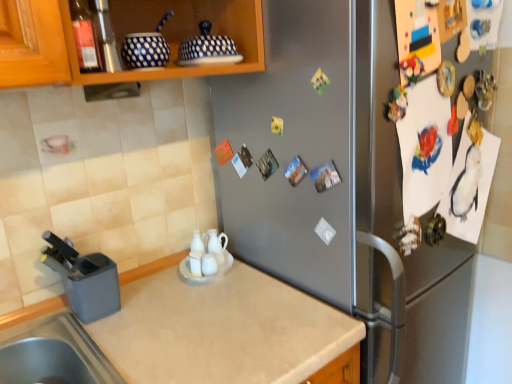
Locate an element on the screen. The width and height of the screenshot is (512, 384). empty space that is to the right of white glossy tea pot at center is located at coordinates (261, 273).